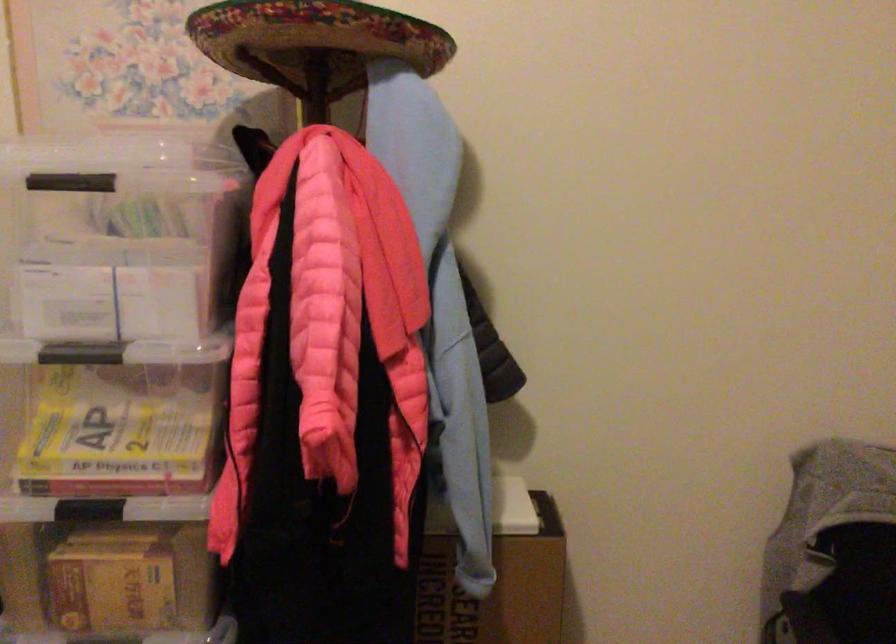
Locate an element on the screen. The height and width of the screenshot is (644, 896). woven sombrero hat is located at coordinates (314, 40).